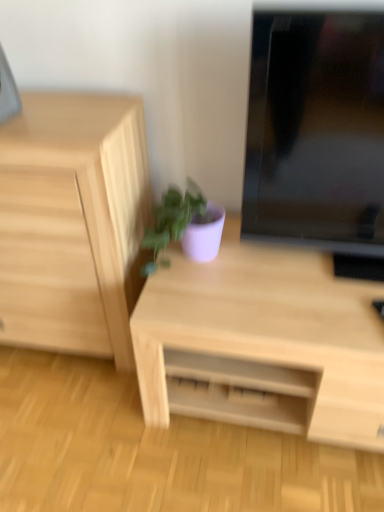
Identify the location of empty space that is ontop of light wood desk at center. (271, 284).